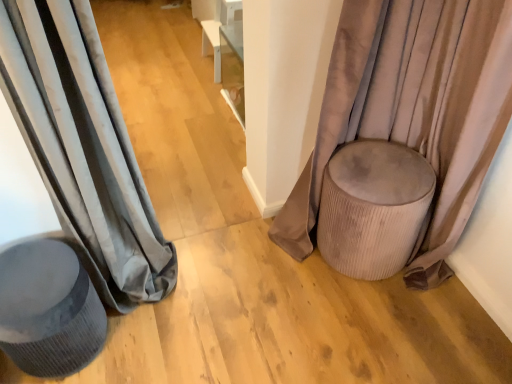
Locate an element on the screen. The image size is (512, 384). vacant space in between matte gray curtain at left, the 2th curtain positioned from the right, and matte gray stool at left is located at coordinates (148, 329).